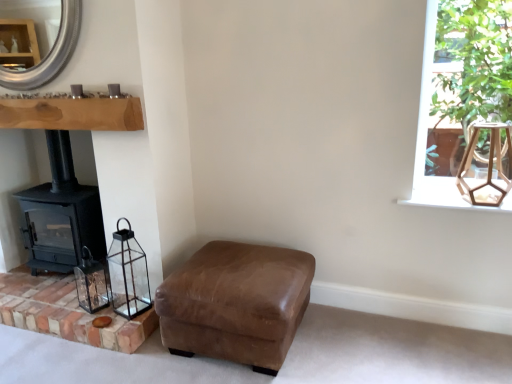
Locate an element on the screen. vacant location behind clear glass lantern at lower left is located at coordinates (101, 293).